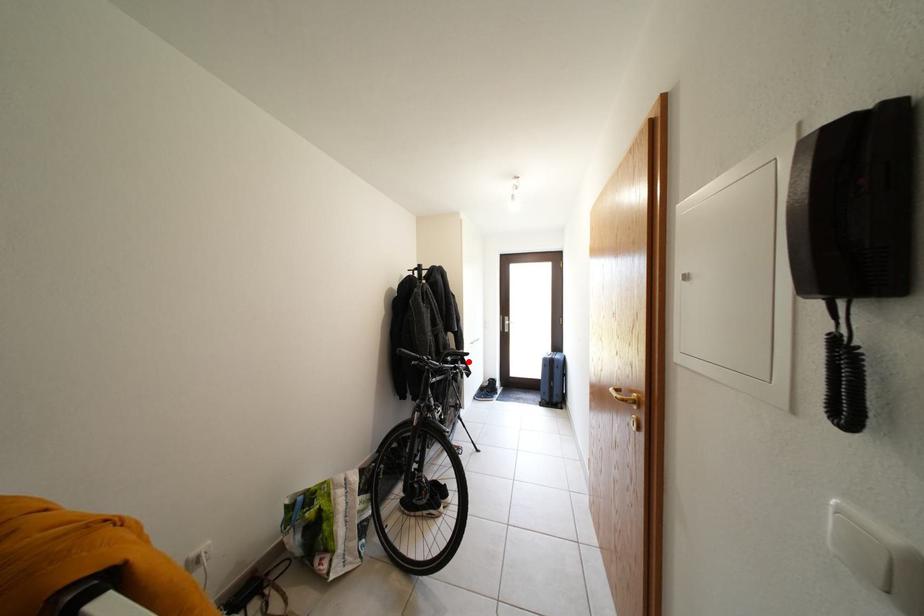
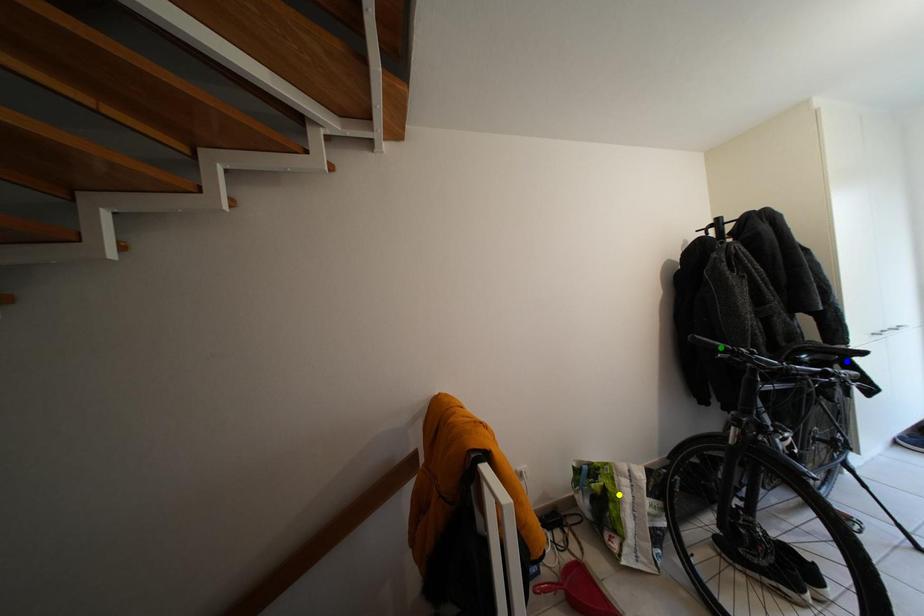
Question: I am providing you with two images of the same scene from different viewpoints. A red point is marked on the first image. You are given multiple points on the second image. Which point in image 2 represents the same 3d spot as the red point in image 1?

Choices:
 (A) green point
 (B) blue point
 (C) yellow point

Answer: (B)